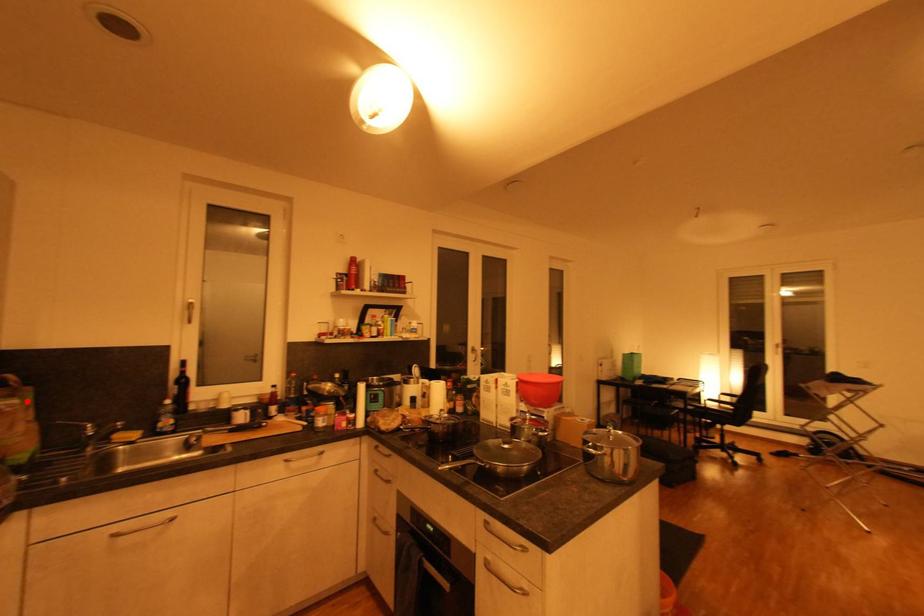
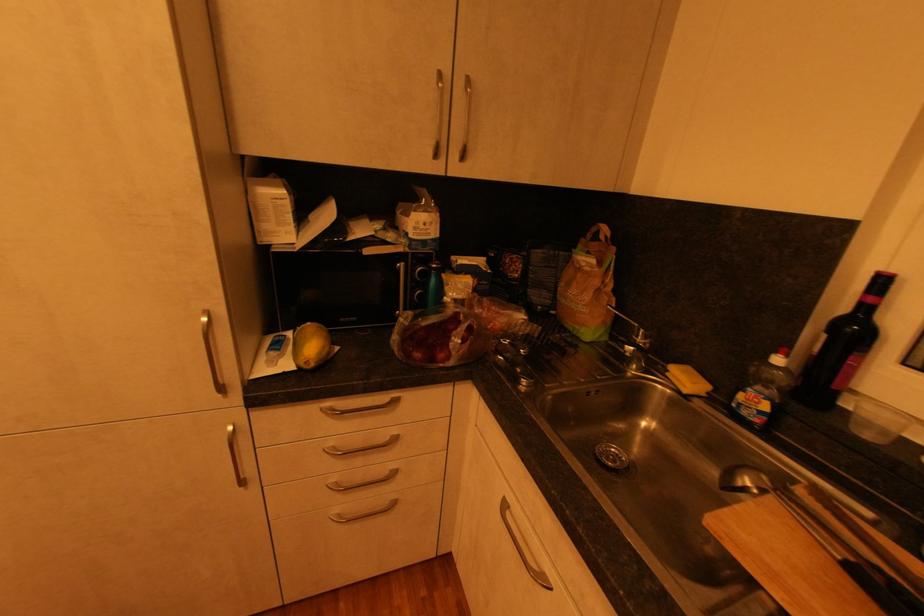
Question: I am providing you with two images of the same scene from different viewpoints. A red point is marked on the first image. Is the red point's position out of view in image 2?

Choices:
 (A) Yes
 (B) No

Answer: (B)